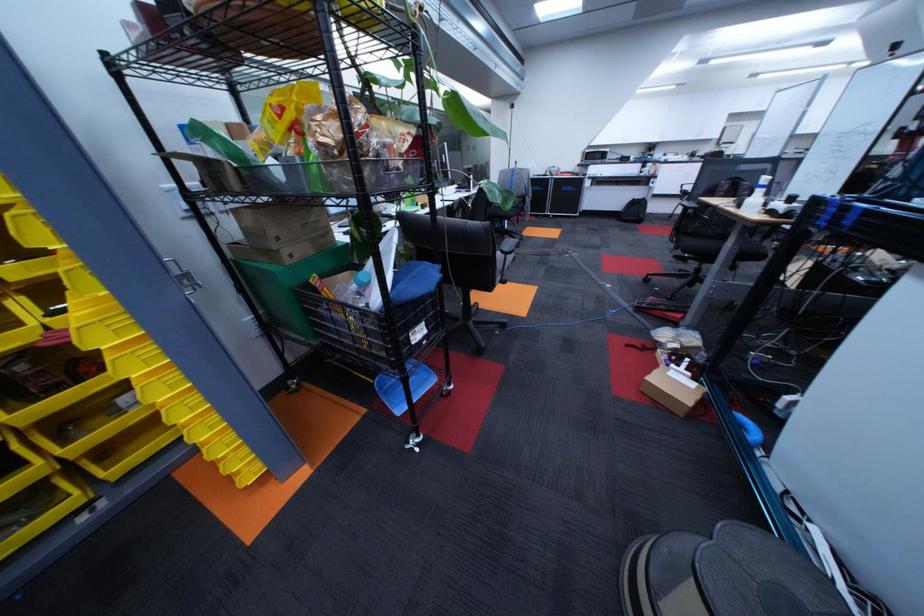
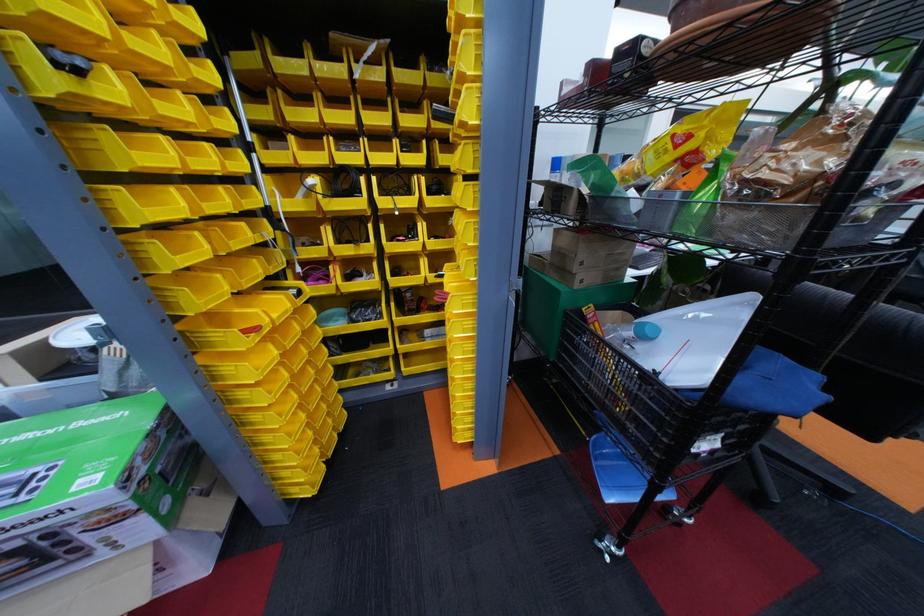
Find the pixel in the second image that matches the point at 455,273 in the first image.

(841, 391)